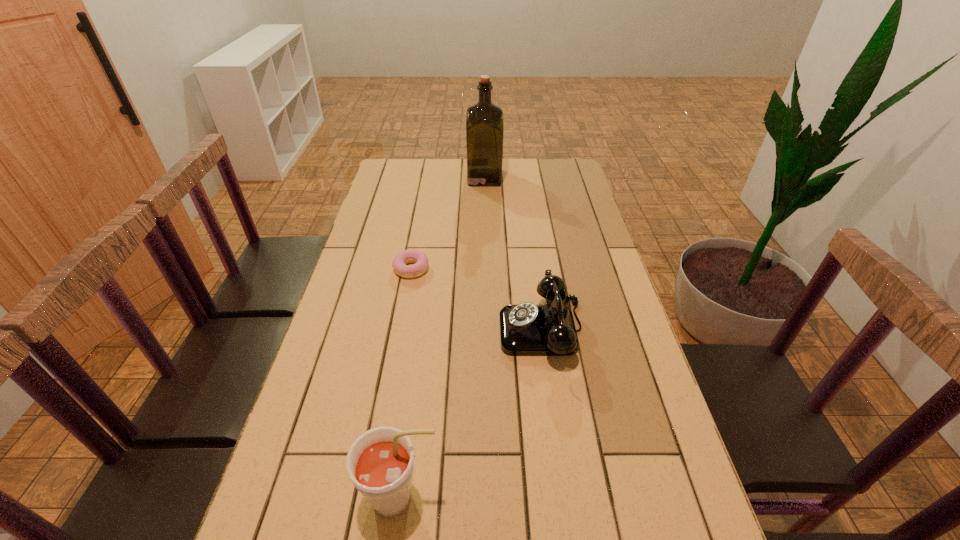
Find the location of a particular element. vacant area at the left edge is located at coordinates (324, 492).

Image resolution: width=960 pixels, height=540 pixels. I want to click on vacant space at the right edge of the desktop, so click(579, 264).

Image resolution: width=960 pixels, height=540 pixels. I want to click on vacant space at the far left corner, so click(x=398, y=163).

At what (x,y) coordinates should I click in order to perform the action: click on vacant region between the root beer and the tallest object. Please return your answer as a coordinate pair (x, y). This screenshot has height=540, width=960. Looking at the image, I should click on (443, 338).

This screenshot has height=540, width=960. What are the coordinates of `vacant area that lies between the telephone and the farthest object` in the screenshot? It's located at pos(513,253).

Where is `unoccupied position between the nearest object and the farthest object`? This screenshot has height=540, width=960. unoccupied position between the nearest object and the farthest object is located at coordinates (443, 338).

This screenshot has height=540, width=960. I want to click on empty space that is in between the tallest object and the doughnut, so click(447, 223).

The image size is (960, 540). In order to click on blank region between the shortest object and the third farthest object in this screenshot , I will do `click(476, 299)`.

Identify the location of the second closest object to the root beer. (420, 259).

Locate which object is the third closest to the third farthest object. Please provide its 2D coordinates. Your answer should be formatted as a tuple, i.e. [(x, y)], where the tuple contains the x and y coordinates of a point satisfying the conditions above.

[(484, 121)]